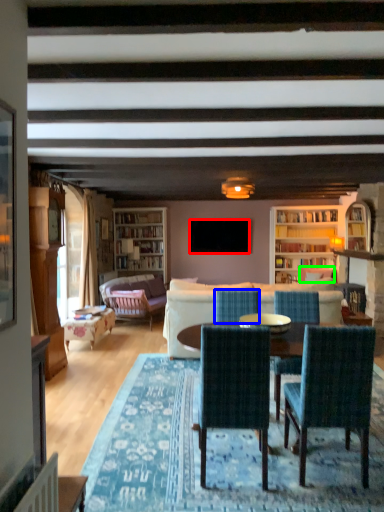
Question: Which object is positioned closest to television (highlighted by a red box)? Select from chair (highlighted by a blue box) and armchair (highlighted by a green box).

Choices:
 (A) chair
 (B) armchair

Answer: (B)